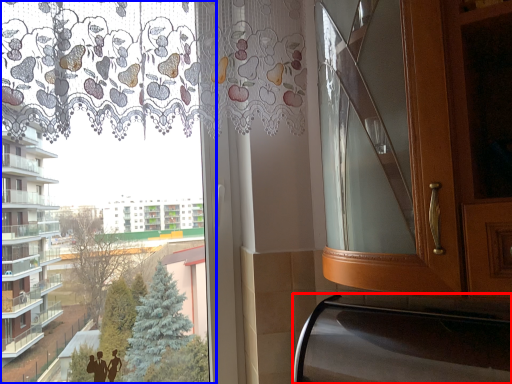
Question: Which of the following is the farthest to the observer, oven (highlighted by a red box) or bay window (highlighted by a blue box)?

Choices:
 (A) oven
 (B) bay window

Answer: (B)